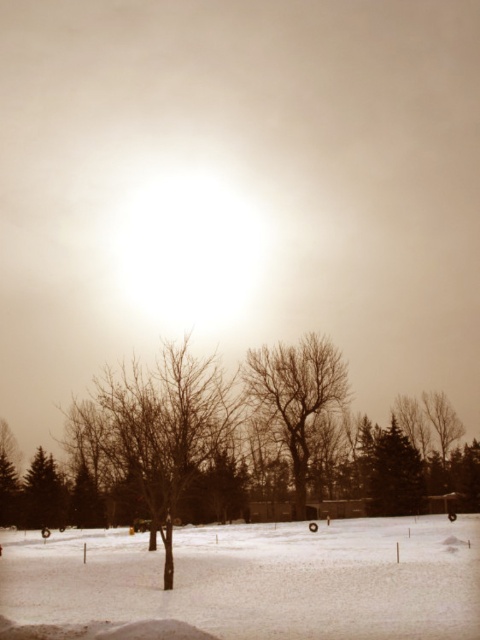
Question: Among these objects, which one is nearest to the camera?

Choices:
 (A) green textured evergreen at center
 (B) white powdery snow at center
 (C) bare branches at center
 (D) bare wood tree at center

Answer: (B)

Question: Does white powdery snow at center have a greater width compared to bare wood tree at center?

Choices:
 (A) yes
 (B) no

Answer: (A)

Question: Can you confirm if white powdery snow at center is positioned below green textured evergreen at center?

Choices:
 (A) no
 (B) yes

Answer: (A)

Question: Which object is the closest to the bare wood tree at center?

Choices:
 (A) green textured evergreen at center
 (B) bare branches at center

Answer: (A)

Question: Which of these objects is positioned closest to the white powdery snow at center?

Choices:
 (A) green textured evergreen at center
 (B) bare branches at center
 (C) bare wood tree at center

Answer: (B)

Question: Is bare wood tree at center below green textured evergreen at center?

Choices:
 (A) no
 (B) yes

Answer: (A)